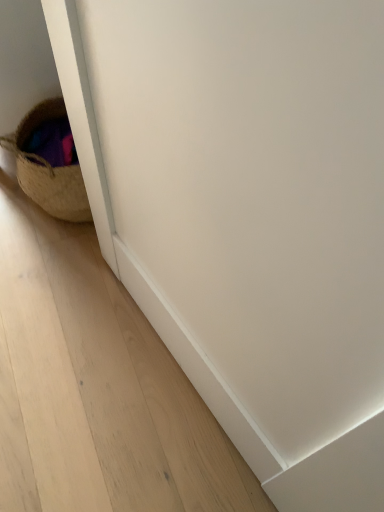
This screenshot has width=384, height=512. What do you see at coordinates (49, 170) in the screenshot?
I see `brown woven basket at lower left` at bounding box center [49, 170].

Where is `brown woven basket at lower left`? The width and height of the screenshot is (384, 512). brown woven basket at lower left is located at coordinates (49, 170).

What is the approximate width of brown woven basket at lower left?

brown woven basket at lower left is 18.74 centimeters in width.

Where is `brown woven basket at lower left`? brown woven basket at lower left is located at coordinates (49, 170).